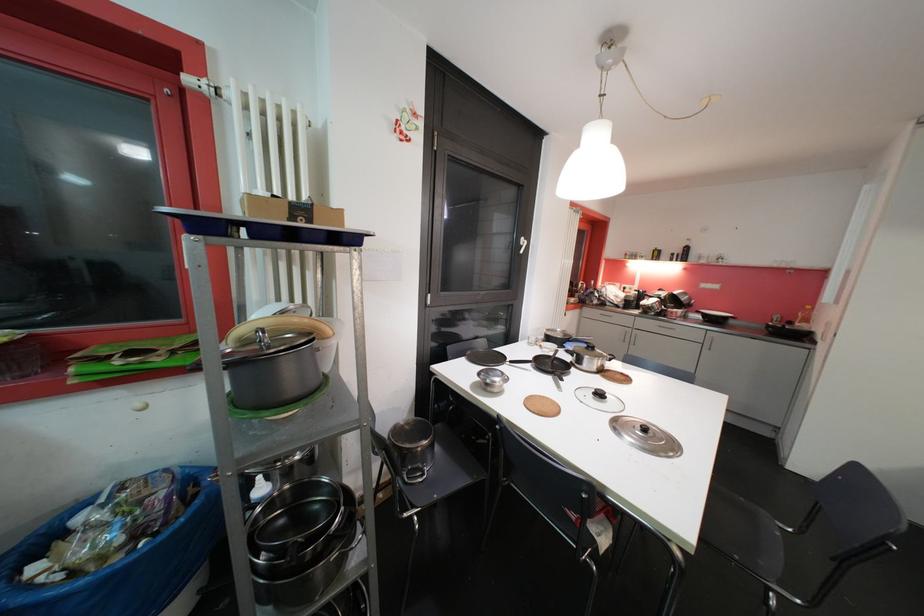
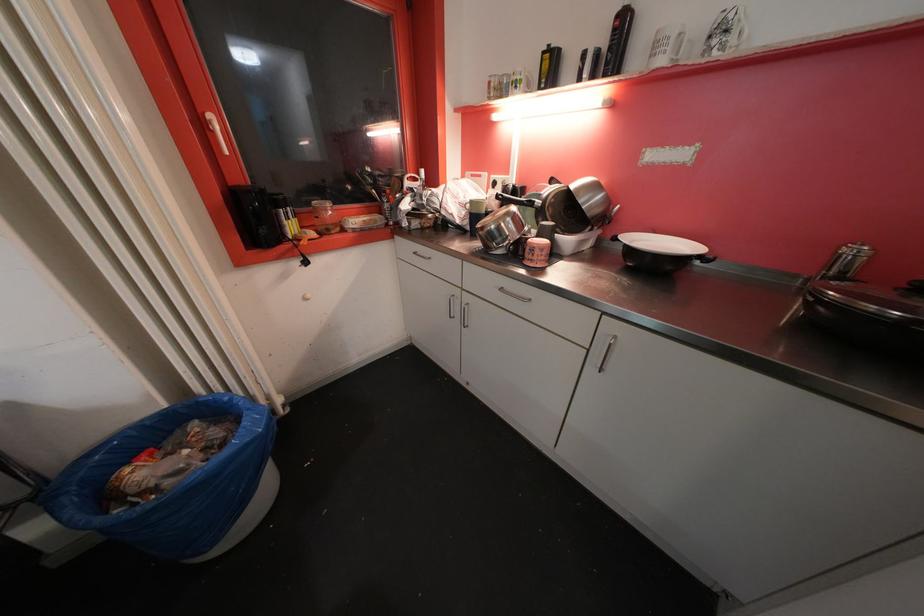
Locate, in the second image, the point that corresponds to point 691,251 in the first image.

(628, 25)